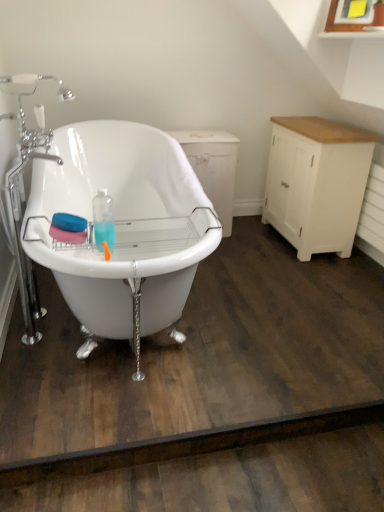
Question: Is white painted wood cabinet at right aimed at white glossy bathtub at center?

Choices:
 (A) no
 (B) yes

Answer: (B)

Question: Are white painted wood cabinet at right and white glossy bathtub at center located far from each other?

Choices:
 (A) no
 (B) yes

Answer: (B)

Question: Is white painted wood cabinet at right closer to the viewer compared to white glossy bathtub at center?

Choices:
 (A) yes
 (B) no

Answer: (B)

Question: Is white painted wood cabinet at right bigger than white glossy bathtub at center?

Choices:
 (A) yes
 (B) no

Answer: (B)

Question: Is white painted wood cabinet at right wider than white glossy bathtub at center?

Choices:
 (A) yes
 (B) no

Answer: (B)

Question: Is white painted wood cabinet at right placed right next to white glossy bathtub at center?

Choices:
 (A) no
 (B) yes

Answer: (A)

Question: Does white wood dresser at right have a smaller size compared to white glossy bathtub at center?

Choices:
 (A) yes
 (B) no

Answer: (A)

Question: Can white glossy bathtub at center be found inside white wood dresser at right?

Choices:
 (A) no
 (B) yes

Answer: (A)

Question: Is white wood dresser at right at the left side of white glossy bathtub at center?

Choices:
 (A) no
 (B) yes

Answer: (A)

Question: From a real-world perspective, is white wood dresser at right beneath white glossy bathtub at center?

Choices:
 (A) no
 (B) yes

Answer: (B)

Question: Is white wood dresser at right positioned behind white glossy bathtub at center?

Choices:
 (A) yes
 (B) no

Answer: (A)

Question: From the image's perspective, is white wood dresser at right below white glossy bathtub at center?

Choices:
 (A) no
 (B) yes

Answer: (A)

Question: Is white glossy bathtub at center behind white wood dresser at right?

Choices:
 (A) no
 (B) yes

Answer: (A)